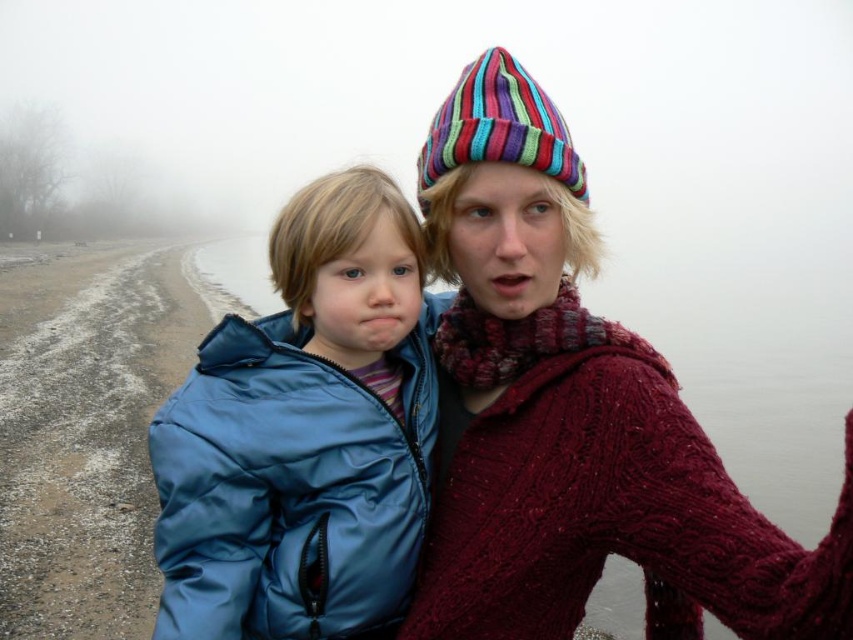
Does point (622, 326) come in front of point (515, 120)?

No, it is not.

Between knitted maroon sweater at center and multicolored knitted beanie at upper center, which one has more height?

knitted maroon sweater at center

Between point (538, 433) and point (582, 188), which one is positioned behind?

Positioned behind is point (582, 188).

I want to click on knitted maroon sweater at center, so click(x=573, y=417).

Consider the image. Is knitted maroon sweater at center above blue puffy jacket at left?

Yes.

Consider the image. Who is more distant from viewer, (846,492) or (323,465)?

The point (323,465) is more distant.

Locate an element on the screen. knitted maroon sweater at center is located at coordinates (573, 417).

The height and width of the screenshot is (640, 853). I want to click on knitted maroon sweater at center, so click(573, 417).

Does blue puffy jacket at left come behind multicolored knitted beanie at upper center?

No, it is not.

The width and height of the screenshot is (853, 640). What do you see at coordinates (305, 433) in the screenshot? I see `blue puffy jacket at left` at bounding box center [305, 433].

Is point (178, 408) farther from viewer compared to point (577, 179)?

No, it is in front of (577, 179).

I want to click on blue puffy jacket at left, so click(305, 433).